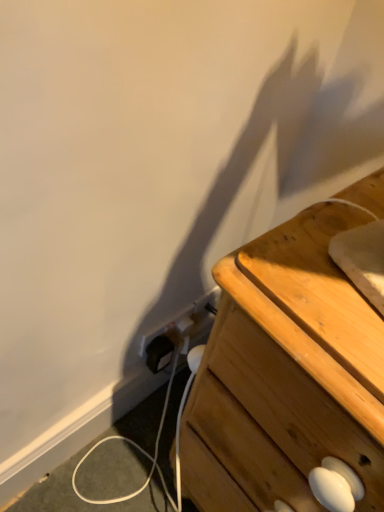
Measure the distance between point (308, 313) and camera.

40.90 centimeters.

What is the approximate width of wooden chest of drawers at right?

wooden chest of drawers at right is 18.80 inches in width.

Image resolution: width=384 pixels, height=512 pixels. What do you see at coordinates (286, 375) in the screenshot?
I see `wooden chest of drawers at right` at bounding box center [286, 375].

Find the location of a particular element. Image resolution: width=384 pixels, height=512 pixels. wooden chest of drawers at right is located at coordinates (286, 375).

This screenshot has height=512, width=384. What are the coordinates of `white plastic electric outlet at lower center` in the screenshot? It's located at (180, 332).

What do you see at coordinates (180, 332) in the screenshot? I see `white plastic electric outlet at lower center` at bounding box center [180, 332].

The height and width of the screenshot is (512, 384). I want to click on wooden chest of drawers at right, so click(x=286, y=375).

Is white plastic electric outlet at lower center to the right of wooden chest of drawers at right from the viewer's perspective?

Incorrect, white plastic electric outlet at lower center is not on the right side of wooden chest of drawers at right.

Which object is closer to the camera, white plastic electric outlet at lower center or wooden chest of drawers at right?

wooden chest of drawers at right is in front.

Is point (209, 325) in front of point (187, 474)?

No, (209, 325) is further to viewer.

From the image's perspective, would you say white plastic electric outlet at lower center is positioned over wooden chest of drawers at right?

Yes, from the image's perspective, white plastic electric outlet at lower center is on top of wooden chest of drawers at right.

From a real-world perspective, does white plastic electric outlet at lower center stand above wooden chest of drawers at right?

Incorrect, from a real-world perspective, white plastic electric outlet at lower center is lower than wooden chest of drawers at right.

Which of these two, white plastic electric outlet at lower center or wooden chest of drawers at right, is wider?

With larger width is wooden chest of drawers at right.

Which of these two, white plastic electric outlet at lower center or wooden chest of drawers at right, stands taller?

With more height is wooden chest of drawers at right.

Looking at the image, does white plastic electric outlet at lower center seem bigger or smaller compared to wooden chest of drawers at right?

Clearly, white plastic electric outlet at lower center is smaller in size than wooden chest of drawers at right.

Do you think white plastic electric outlet at lower center is within wooden chest of drawers at right, or outside of it?

white plastic electric outlet at lower center is not enclosed by wooden chest of drawers at right.

Is white plastic electric outlet at lower center far from wooden chest of drawers at right?

white plastic electric outlet at lower center is actually quite close to wooden chest of drawers at right.

Is wooden chest of drawers at right at the back of white plastic electric outlet at lower center?

No.

How many degrees apart are the facing directions of white plastic electric outlet at lower center and wooden chest of drawers at right?

90 degrees separate the facing orientations of white plastic electric outlet at lower center and wooden chest of drawers at right.

Locate an element on the screen. The image size is (384, 512). the chest of drawers that appears in front of the white plastic electric outlet at lower center is located at coordinates (286, 375).

Which is more to the right, wooden chest of drawers at right or white plastic electric outlet at lower center?

wooden chest of drawers at right is more to the right.

Who is more distant, wooden chest of drawers at right or white plastic electric outlet at lower center?

white plastic electric outlet at lower center is behind.

Is point (307, 280) positioned before point (154, 344)?

Yes, point (307, 280) is closer to viewer.

From the image's perspective, is wooden chest of drawers at right located above white plastic electric outlet at lower center?

No.

From a real-world perspective, is wooden chest of drawers at right beneath white plastic electric outlet at lower center?

No, from a real-world perspective, wooden chest of drawers at right is not beneath white plastic electric outlet at lower center.

Between wooden chest of drawers at right and white plastic electric outlet at lower center, which one has larger width?

Wider between the two is wooden chest of drawers at right.

In the scene shown: Between wooden chest of drawers at right and white plastic electric outlet at lower center, which one has less height?

With less height is white plastic electric outlet at lower center.

Which of these two, wooden chest of drawers at right or white plastic electric outlet at lower center, is smaller?

white plastic electric outlet at lower center.

Would you say white plastic electric outlet at lower center is part of wooden chest of drawers at right's contents?

No, white plastic electric outlet at lower center is not surrounded by wooden chest of drawers at right.

Is wooden chest of drawers at right not close to white plastic electric outlet at lower center?

No.

Is wooden chest of drawers at right turned away from white plastic electric outlet at lower center?

That's not correct — wooden chest of drawers at right is not looking away from white plastic electric outlet at lower center.

How many degrees apart are the facing directions of wooden chest of drawers at right and white plastic electric outlet at lower center?

They differ by 90 degrees in their facing directions.

Could you measure the distance between wooden chest of drawers at right and white plastic electric outlet at lower center?

wooden chest of drawers at right is 15.97 inches away from white plastic electric outlet at lower center.

Where is `electric outlet directly beneath the wooden chest of drawers at right (from a real-world perspective)`? The width and height of the screenshot is (384, 512). electric outlet directly beneath the wooden chest of drawers at right (from a real-world perspective) is located at coordinates (180, 332).

The width and height of the screenshot is (384, 512). Identify the location of the chest of drawers located in front of the white plastic electric outlet at lower center. (286, 375).

Where is `electric outlet lying above the wooden chest of drawers at right (from the image's perspective)`? This screenshot has height=512, width=384. electric outlet lying above the wooden chest of drawers at right (from the image's perspective) is located at coordinates (180, 332).